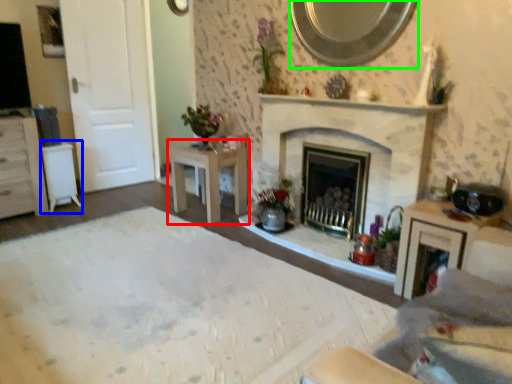
Question: Which object is the closest to the table (highlighted by a red box)? Choose among these: table (highlighted by a blue box) or mirror (highlighted by a green box).

Choices:
 (A) table
 (B) mirror

Answer: (A)